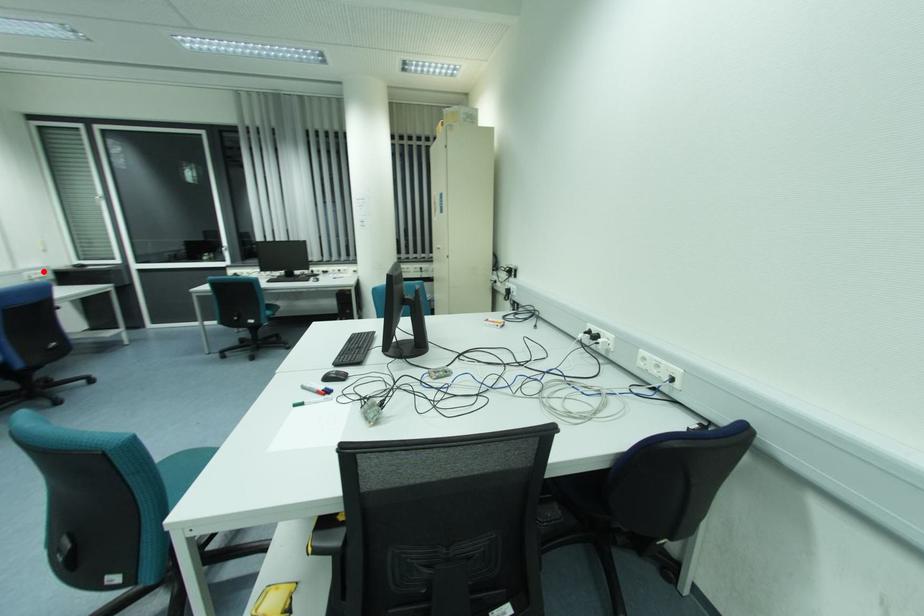
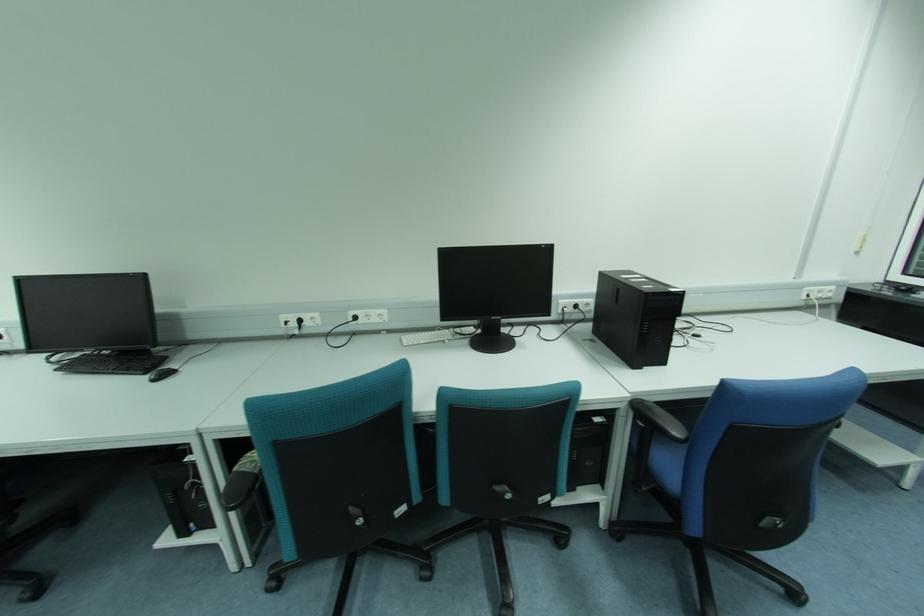
The point at the highlighted location is marked in the first image. Where is the corresponding point in the second image?

(833, 288)